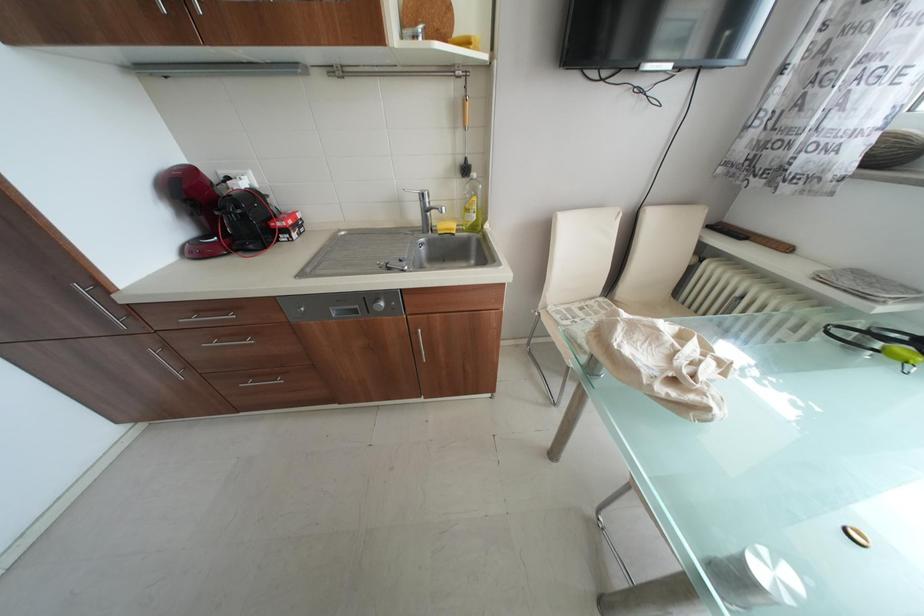
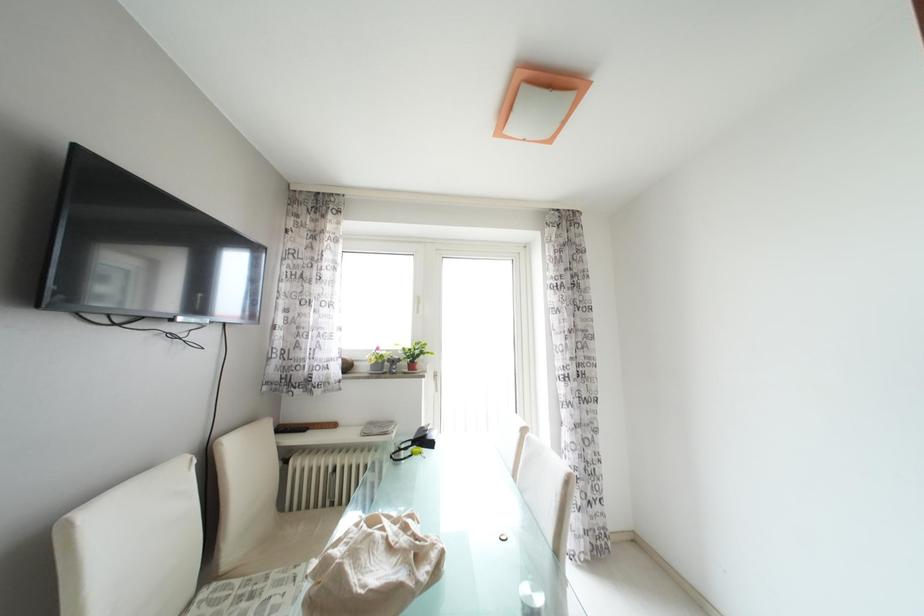
Question: Based on the continuous images, in which direction is the camera rotating? Reply with the corresponding letter.

Choices:
 (A) Left
 (B) Right
 (C) Up
 (D) Down

Answer: (B)